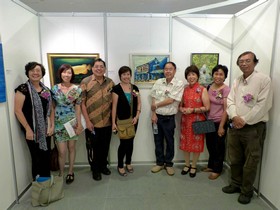
The height and width of the screenshot is (210, 280). Find the location of `wall to the left of people`. wall to the left of people is located at coordinates (13, 46).